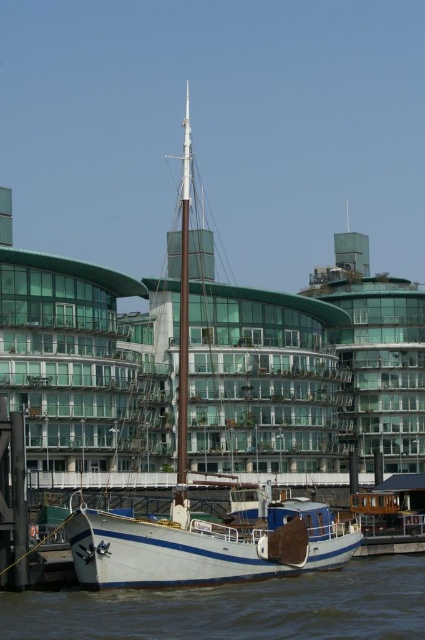
You are a photographer planning to capture the white matte boat at center and the white matte mast at center in a single frame. Given that your camera has a fixed focal length, which object should you prioritize positioning closer to the camera to ensure both are visible without cropping?

Since the white matte boat at center is larger in size than the white matte mast at center, you should prioritize positioning the white matte mast at center closer to the camera. This way, both objects will be accommodated within the frame without cropping.